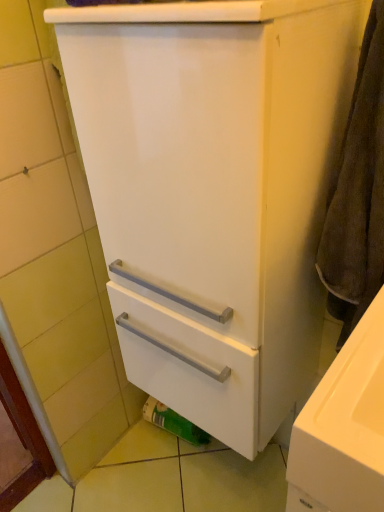
Locate an element on the screen. The height and width of the screenshot is (512, 384). green matte toilet paper at lower center is located at coordinates (173, 422).

The width and height of the screenshot is (384, 512). What do you see at coordinates (173, 422) in the screenshot?
I see `green matte toilet paper at lower center` at bounding box center [173, 422].

Image resolution: width=384 pixels, height=512 pixels. In order to click on brown textured towel at right in this screenshot , I will do `click(358, 193)`.

This screenshot has width=384, height=512. What do you see at coordinates (358, 193) in the screenshot? I see `brown textured towel at right` at bounding box center [358, 193].

The width and height of the screenshot is (384, 512). In order to click on green matte toilet paper at lower center in this screenshot , I will do `click(173, 422)`.

Considering the relative positions of green matte toilet paper at lower center and brown textured towel at right in the image provided, is green matte toilet paper at lower center to the left of brown textured towel at right from the viewer's perspective?

Yes, green matte toilet paper at lower center is to the left of brown textured towel at right.

Which is in front, green matte toilet paper at lower center or brown textured towel at right?

brown textured towel at right is more forward.

Is point (165, 425) in front of point (350, 318)?

No.

From the image's perspective, is green matte toilet paper at lower center beneath brown textured towel at right?

Yes, from the image's perspective, green matte toilet paper at lower center is beneath brown textured towel at right.

From a real-world perspective, which object rests below the other?

From a 3D spatial view, green matte toilet paper at lower center is below.

Between green matte toilet paper at lower center and brown textured towel at right, which one has larger width?

With larger width is brown textured towel at right.

From their relative heights in the image, would you say green matte toilet paper at lower center is taller or shorter than brown textured towel at right?

Considering their sizes, green matte toilet paper at lower center has less height than brown textured towel at right.

Can you confirm if green matte toilet paper at lower center is smaller than brown textured towel at right?

Indeed, green matte toilet paper at lower center has a smaller size compared to brown textured towel at right.

Is brown textured towel at right located within green matte toilet paper at lower center?

No, green matte toilet paper at lower center does not contain brown textured towel at right.

Is green matte toilet paper at lower center placed right next to brown textured towel at right?

green matte toilet paper at lower center is not next to brown textured towel at right, and they're not touching.

Could you tell me if green matte toilet paper at lower center is turned towards brown textured towel at right?

No, green matte toilet paper at lower center is not turned towards brown textured towel at right.

Can you tell me how much green matte toilet paper at lower center and brown textured towel at right differ in facing direction?

The angle between the facing direction of green matte toilet paper at lower center and the facing direction of brown textured towel at right is 10.4 degrees.

I want to click on toilet paper behind the brown textured towel at right, so click(x=173, y=422).

Visually, is brown textured towel at right positioned to the left or to the right of green matte toilet paper at lower center?

Clearly, brown textured towel at right is on the right of green matte toilet paper at lower center in the image.

Considering the positions of objects brown textured towel at right and green matte toilet paper at lower center in the image provided, who is behind, brown textured towel at right or green matte toilet paper at lower center?

green matte toilet paper at lower center is behind.

Which point is more distant from viewer, (x=345, y=130) or (x=191, y=435)?

The point (x=191, y=435) is behind.

From the image's perspective, does brown textured towel at right appear lower than green matte toilet paper at lower center?

No, from the image's perspective, brown textured towel at right is not beneath green matte toilet paper at lower center.

From a real-world perspective, is brown textured towel at right positioned above or below green matte toilet paper at lower center?

Clearly, from a real-world perspective, brown textured towel at right is above green matte toilet paper at lower center.

Does brown textured towel at right have a lesser width compared to green matte toilet paper at lower center?

No, brown textured towel at right is not thinner than green matte toilet paper at lower center.

Which of these two, brown textured towel at right or green matte toilet paper at lower center, stands shorter?

Standing shorter between the two is green matte toilet paper at lower center.

Considering the sizes of brown textured towel at right and green matte toilet paper at lower center in the image, is brown textured towel at right bigger or smaller than green matte toilet paper at lower center?

Clearly, brown textured towel at right is larger in size than green matte toilet paper at lower center.

Is brown textured towel at right spatially inside green matte toilet paper at lower center, or outside of it?

brown textured towel at right is spatially situated outside green matte toilet paper at lower center.

Is brown textured towel at right positioned far away from green matte toilet paper at lower center?

No, brown textured towel at right is not far away from green matte toilet paper at lower center.

From the picture: Does brown textured towel at right turn towards green matte toilet paper at lower center?

No, brown textured towel at right is not aimed at green matte toilet paper at lower center.

Measure the distance between brown textured towel at right and green matte toilet paper at lower center.

brown textured towel at right is 36.88 inches from green matte toilet paper at lower center.

The width and height of the screenshot is (384, 512). I want to click on toilet paper that is behind the brown textured towel at right, so click(173, 422).

Where is `toilet paper below the brown textured towel at right (from a real-world perspective)`? toilet paper below the brown textured towel at right (from a real-world perspective) is located at coordinates (173, 422).

The width and height of the screenshot is (384, 512). What are the coordinates of `toilet paper lying on the left of brown textured towel at right` in the screenshot? It's located at (173, 422).